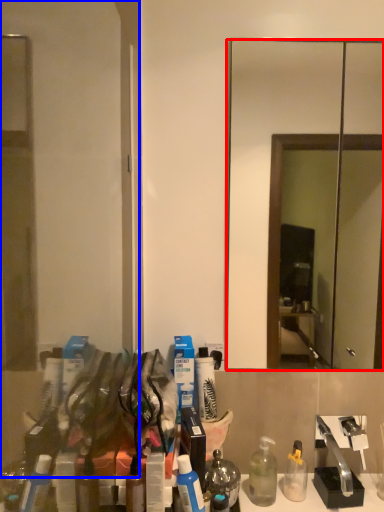
Question: Which object appears closest to the camera in this image, mirror (highlighted by a red box) or glass door (highlighted by a blue box)?

Choices:
 (A) mirror
 (B) glass door

Answer: (B)